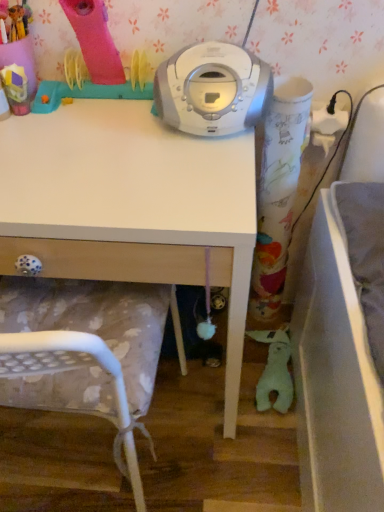
I want to click on vacant space that is to the left of white plastic cd player at center, so click(105, 143).